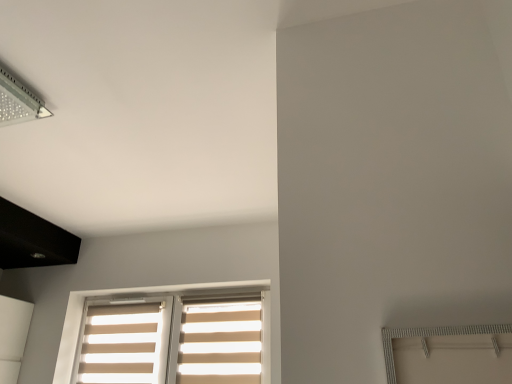
Question: Should I look upward or downward to see beige fabric blinds at lower center?

Choices:
 (A) up
 (B) down

Answer: (B)

Question: Can you see beige fabric curtain at lower center, placed as the first curtain when sorted from right to left, touching transparent plastic lamp at upper left?

Choices:
 (A) no
 (B) yes

Answer: (A)

Question: Considering the relative sizes of beige fabric curtain at lower center, placed as the first curtain when sorted from right to left, and transparent plastic lamp at upper left in the image provided, is beige fabric curtain at lower center, placed as the first curtain when sorted from right to left, thinner than transparent plastic lamp at upper left?

Choices:
 (A) yes
 (B) no

Answer: (A)

Question: Considering the relative sizes of beige fabric curtain at lower center, placed as the first curtain when sorted from right to left, and transparent plastic lamp at upper left in the image provided, is beige fabric curtain at lower center, placed as the first curtain when sorted from right to left, shorter than transparent plastic lamp at upper left?

Choices:
 (A) yes
 (B) no

Answer: (B)

Question: From the image's perspective, is beige fabric curtain at lower center, placed as the first curtain when sorted from right to left, on top of transparent plastic lamp at upper left?

Choices:
 (A) yes
 (B) no

Answer: (B)

Question: Can you confirm if beige fabric curtain at lower center, placed as the first curtain when sorted from right to left, is taller than transparent plastic lamp at upper left?

Choices:
 (A) no
 (B) yes

Answer: (B)

Question: From a real-world perspective, does beige fabric curtain at lower center, placed as the first curtain when sorted from right to left, sit lower than transparent plastic lamp at upper left?

Choices:
 (A) no
 (B) yes

Answer: (B)

Question: Does beige fabric curtain at lower left, marked as the 2th curtain in a right-to-left arrangement, have a greater width compared to beige fabric blinds at lower center?

Choices:
 (A) yes
 (B) no

Answer: (B)

Question: Does beige fabric curtain at lower left, marked as the 2th curtain in a right-to-left arrangement, appear on the left side of beige fabric blinds at lower center?

Choices:
 (A) no
 (B) yes

Answer: (B)

Question: Is beige fabric curtain at lower left, marked as the 2th curtain in a right-to-left arrangement, not inside beige fabric blinds at lower center?

Choices:
 (A) no
 (B) yes

Answer: (A)

Question: Considering the relative positions of beige fabric curtain at lower left, placed as the 1th curtain when sorted from left to right, and beige fabric blinds at lower center in the image provided, is beige fabric curtain at lower left, placed as the 1th curtain when sorted from left to right, to the right of beige fabric blinds at lower center from the viewer's perspective?

Choices:
 (A) yes
 (B) no

Answer: (B)

Question: Is beige fabric curtain at lower left, marked as the 2th curtain in a right-to-left arrangement, placed right next to beige fabric blinds at lower center?

Choices:
 (A) no
 (B) yes

Answer: (A)

Question: Would you say beige fabric blinds at lower center is part of beige fabric curtain at lower left, placed as the 1th curtain when sorted from left to right,'s contents?

Choices:
 (A) no
 (B) yes

Answer: (A)

Question: Does beige fabric curtain at lower left, placed as the 1th curtain when sorted from left to right, come behind transparent plastic lamp at upper left?

Choices:
 (A) no
 (B) yes

Answer: (B)